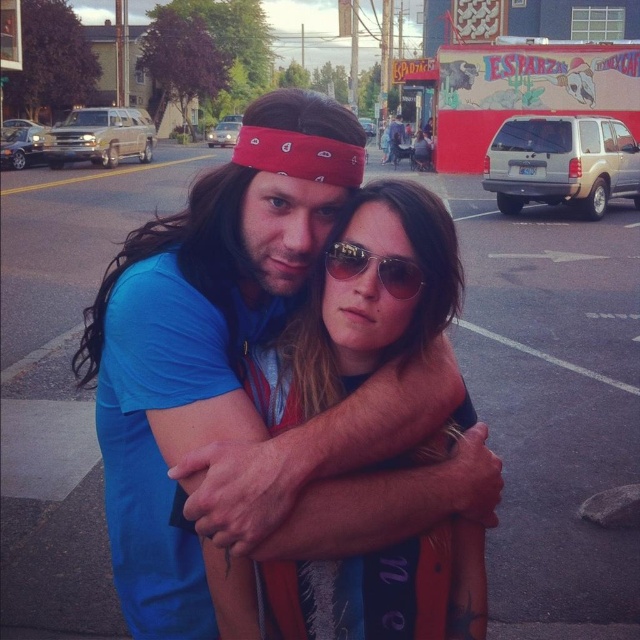
Question: Which object is farther from the camera taking this photo?

Choices:
 (A) sunglasses at center
 (B) matte blue shirt at center

Answer: (A)

Question: Is matte blue shirt at center closer to the viewer compared to sunglasses at center?

Choices:
 (A) no
 (B) yes

Answer: (B)

Question: Is matte blue shirt at center below sunglasses at center?

Choices:
 (A) yes
 (B) no

Answer: (A)

Question: Which point appears closest to the camera in this image?

Choices:
 (A) (362, 268)
 (B) (308, 333)

Answer: (A)

Question: Can you confirm if matte blue shirt at center is thinner than sunglasses at center?

Choices:
 (A) no
 (B) yes

Answer: (A)